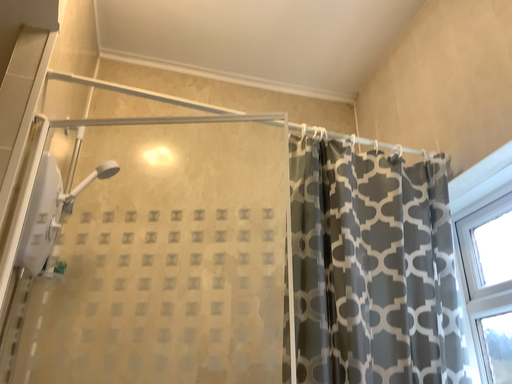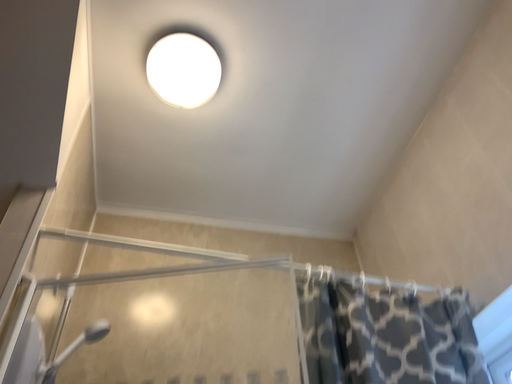
Question: How did the camera likely rotate when shooting the video?

Choices:
 (A) rotated downward
 (B) rotated upward

Answer: (B)